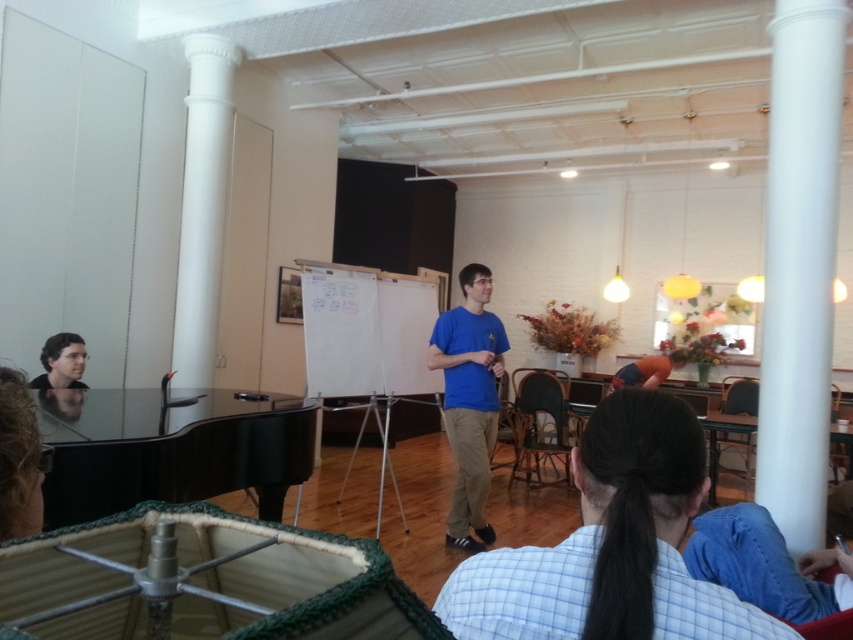
Question: Which point is farther from the camera taking this photo?

Choices:
 (A) (76, 364)
 (B) (469, 340)

Answer: (B)

Question: Where is blue cotton shirt at center located in relation to matte black hair at lower left in the image?

Choices:
 (A) right
 (B) left

Answer: (A)

Question: Can you confirm if blue cotton shirt at center is positioned below matte black hair at lower left?

Choices:
 (A) yes
 (B) no

Answer: (A)

Question: Does blue cotton shirt at center lie in front of matte black hair at lower left?

Choices:
 (A) no
 (B) yes

Answer: (A)